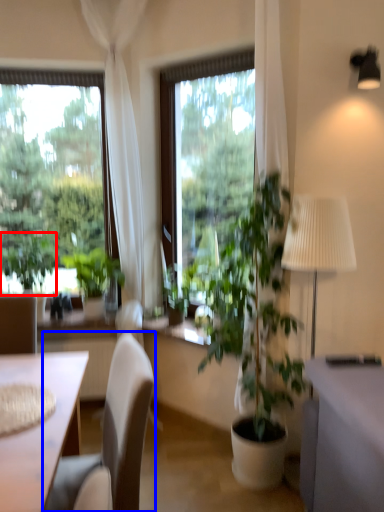
Question: Which point is closer to the camera, plant (highlighted by a red box) or chair (highlighted by a blue box)?

Choices:
 (A) plant
 (B) chair

Answer: (B)